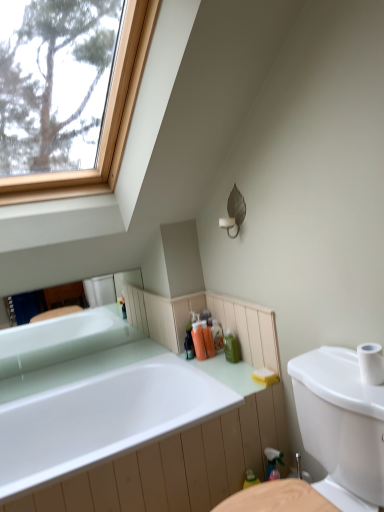
Where is `free space in front of green matte bottle at center, placed as the 1th toiletry when sorted from right to left`? This screenshot has height=512, width=384. free space in front of green matte bottle at center, placed as the 1th toiletry when sorted from right to left is located at coordinates (231, 378).